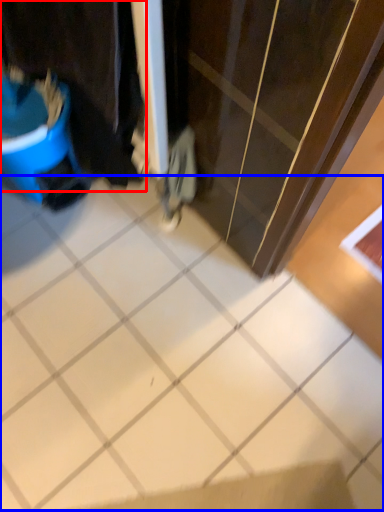
Question: Which of the following is the farthest to the observer, laundry (highlighted by a red box) or ceramic tile (highlighted by a blue box)?

Choices:
 (A) laundry
 (B) ceramic tile

Answer: (A)